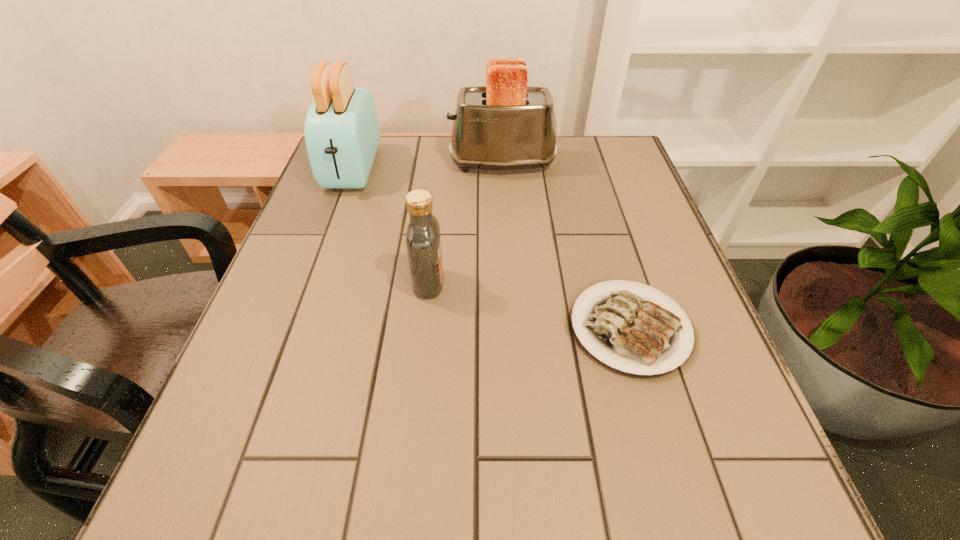
Image resolution: width=960 pixels, height=540 pixels. Identify the location of vacant point located between the third tallest object and the right toaster. (466, 223).

Image resolution: width=960 pixels, height=540 pixels. In order to click on free space between the right toaster and the vodka in this screenshot , I will do `click(466, 223)`.

You are a GUI agent. You are given a task and a screenshot of the screen. Output one action in this format:
    pyautogui.click(x=<x>, y=<y>)
    Task: Click on the empty location between the third tallest object and the right toaster
    Image resolution: width=960 pixels, height=540 pixels.
    Given the screenshot: What is the action you would take?
    pyautogui.click(x=466, y=223)

Find the location of a particular element. This screenshot has height=540, width=960. empty space between the right toaster and the shortest object is located at coordinates (565, 246).

Identify the location of empty space between the vodka and the right toaster. The width and height of the screenshot is (960, 540). (466, 223).

Find the location of `vacant space in between the plate and the leftmost object`. vacant space in between the plate and the leftmost object is located at coordinates (492, 248).

I want to click on free space between the left toaster and the right toaster, so click(x=427, y=166).

Where is `vacant area between the leftmost object and the right toaster`? Image resolution: width=960 pixels, height=540 pixels. vacant area between the leftmost object and the right toaster is located at coordinates (427, 166).

I want to click on object that is the second closest to the leftmost object, so click(423, 237).

Locate an element on the screen. object that stands as the second closest to the right toaster is located at coordinates (423, 237).